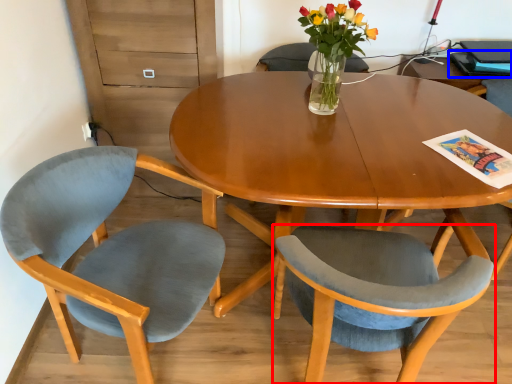
Question: Among these objects, which one is farthest to the camera, chair (highlighted by a red box) or magazine (highlighted by a blue box)?

Choices:
 (A) chair
 (B) magazine

Answer: (B)